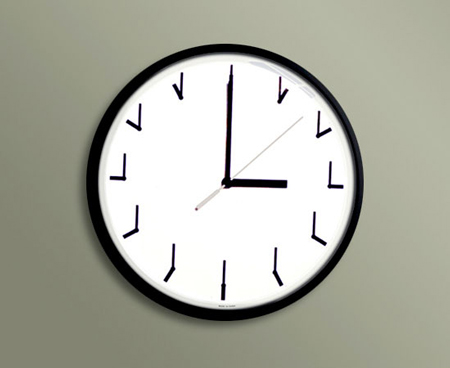
Locate an element on the screen. The image size is (450, 368). hour hand of clock is located at coordinates (258, 183).